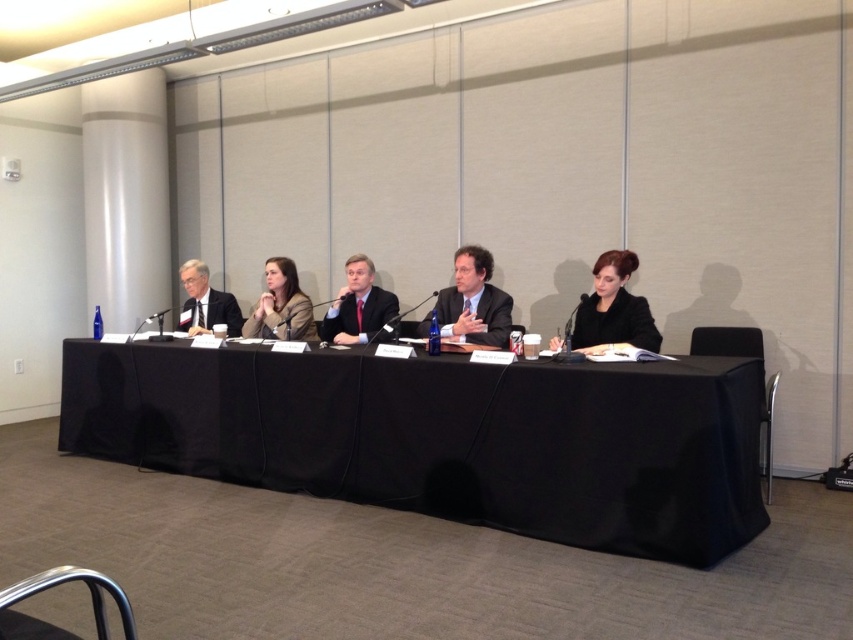
Is dark gray suit at center smaller than matte black suit at center?

No, dark gray suit at center is not smaller than matte black suit at center.

Is dark gray suit at center bigger than matte black suit at center?

Indeed, dark gray suit at center has a larger size compared to matte black suit at center.

Who is more forward, (492, 305) or (352, 304)?

Positioned in front is point (492, 305).

Image resolution: width=853 pixels, height=640 pixels. In order to click on dark gray suit at center in this screenshot , I will do `click(473, 300)`.

Which is more to the left, black fabric table at center or matte black suit at center?

black fabric table at center

Does black fabric table at center appear over matte black suit at center?

No.

Identify the location of black fabric table at center. (445, 436).

Does black fabric table at center have a greater width compared to matte black suit at right?

Yes.

The image size is (853, 640). Describe the element at coordinates (445, 436) in the screenshot. I see `black fabric table at center` at that location.

Is point (218, 429) behind point (625, 301)?

Yes, it is behind point (625, 301).

This screenshot has height=640, width=853. I want to click on black fabric table at center, so click(x=445, y=436).